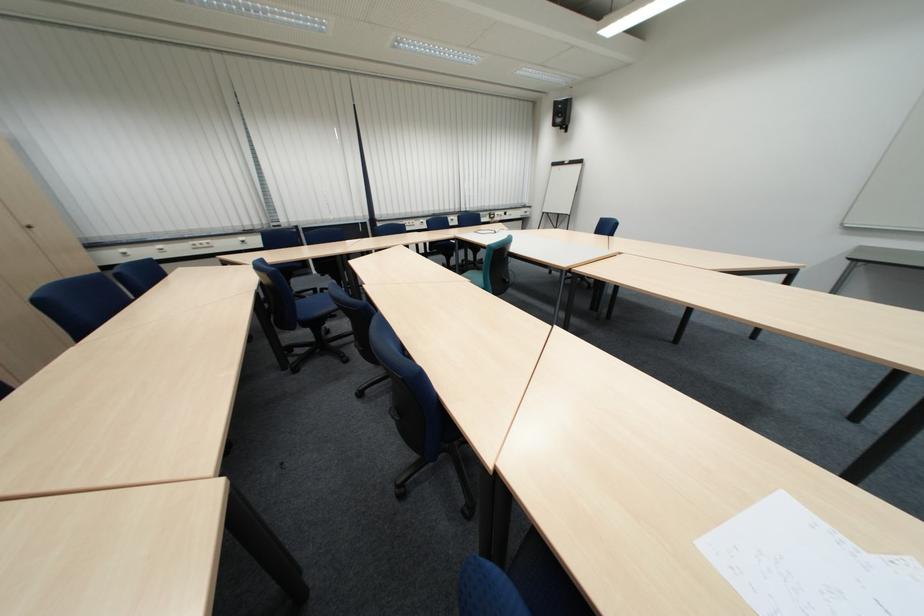
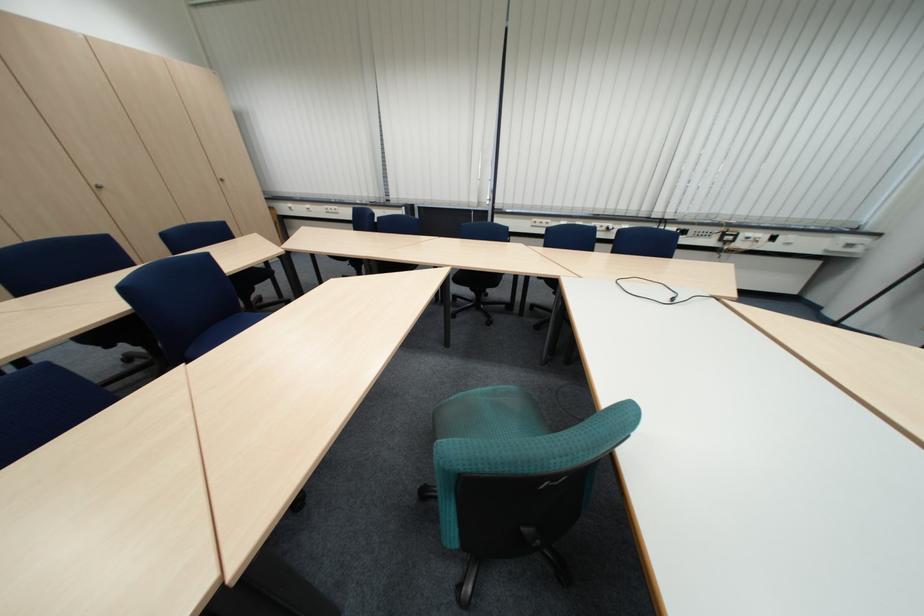
Where in the second image is the point corresponding to (511,215) from the first image?

(759, 235)